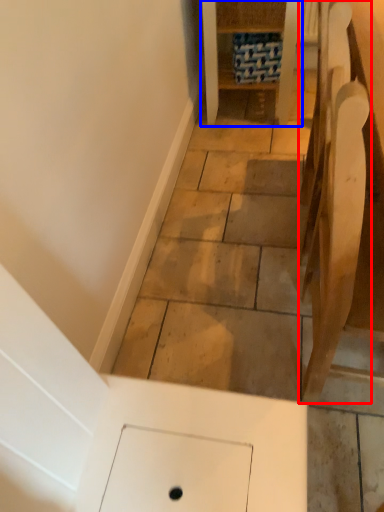
Question: Which object is closer to the camera taking this photo, furniture (highlighted by a red box) or furniture (highlighted by a blue box)?

Choices:
 (A) furniture
 (B) furniture

Answer: (A)